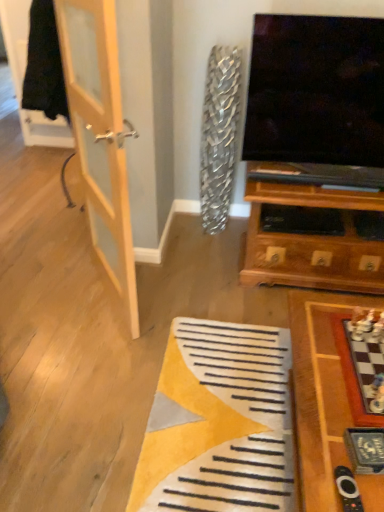
Find the location of a particular element. This screenshot has height=512, width=384. vacant space situated on the left part of light wood door at left is located at coordinates (44, 296).